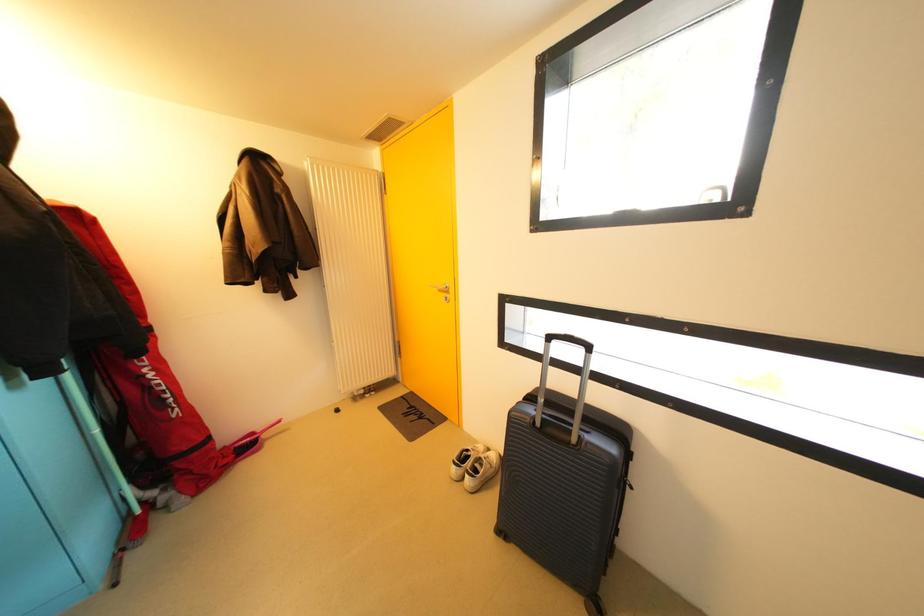
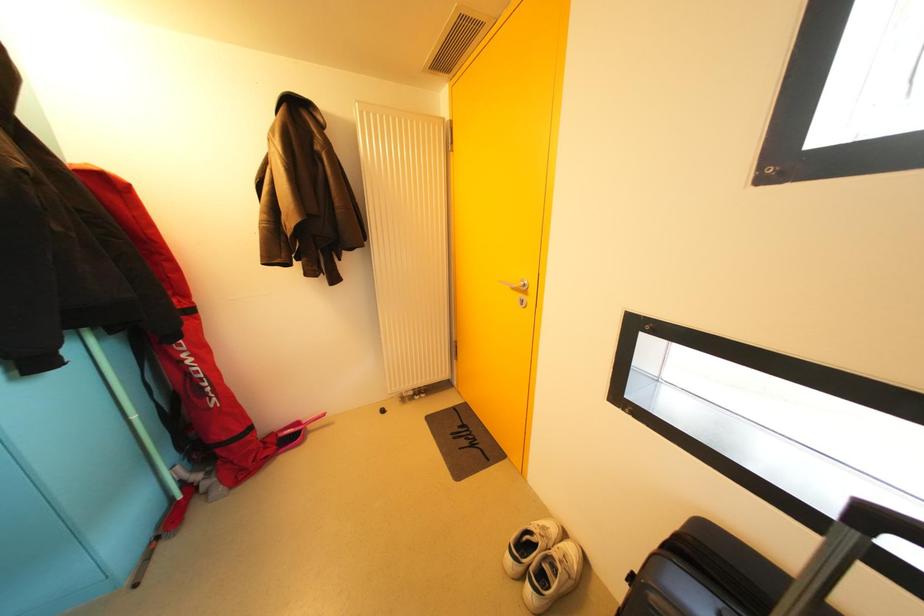
Question: The images are taken continuously from a first-person perspective. In which direction are you moving?

Choices:
 (A) Left
 (B) Right
 (C) Forward
 (D) Backward

Answer: (C)